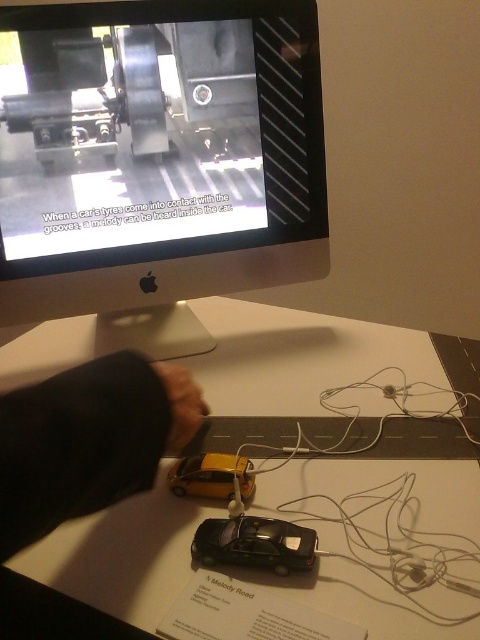
Question: Which object is positioned farthest from the black fabric hand at lower left?

Choices:
 (A) white matte table at center
 (B) brown leather hand at lower center
 (C) yellow matte car at center

Answer: (A)

Question: Does shiny black car at center come behind brown leather hand at lower center?

Choices:
 (A) no
 (B) yes

Answer: (B)

Question: Can you confirm if satin silver monitor at upper center is bigger than black fabric hand at lower left?

Choices:
 (A) yes
 (B) no

Answer: (A)

Question: Which object appears closest to the camera in this image?

Choices:
 (A) brown leather hand at lower center
 (B) satin silver monitor at upper center
 (C) white matte table at center
 (D) yellow matte car at center

Answer: (C)

Question: Estimate the real-world distances between objects in this image. Which object is farther from the shiny black car at center?

Choices:
 (A) brown leather hand at lower center
 (B) satin silver monitor at upper center
 (C) black fabric hand at lower left
 (D) white matte table at center

Answer: (B)

Question: Where is white matte table at center located in relation to black fabric hand at lower left in the image?

Choices:
 (A) below
 (B) above

Answer: (A)